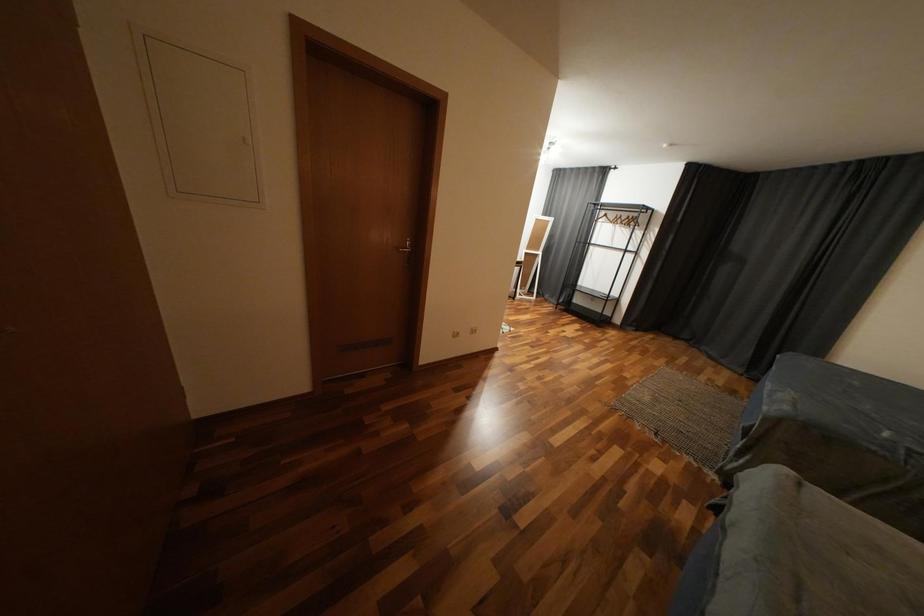
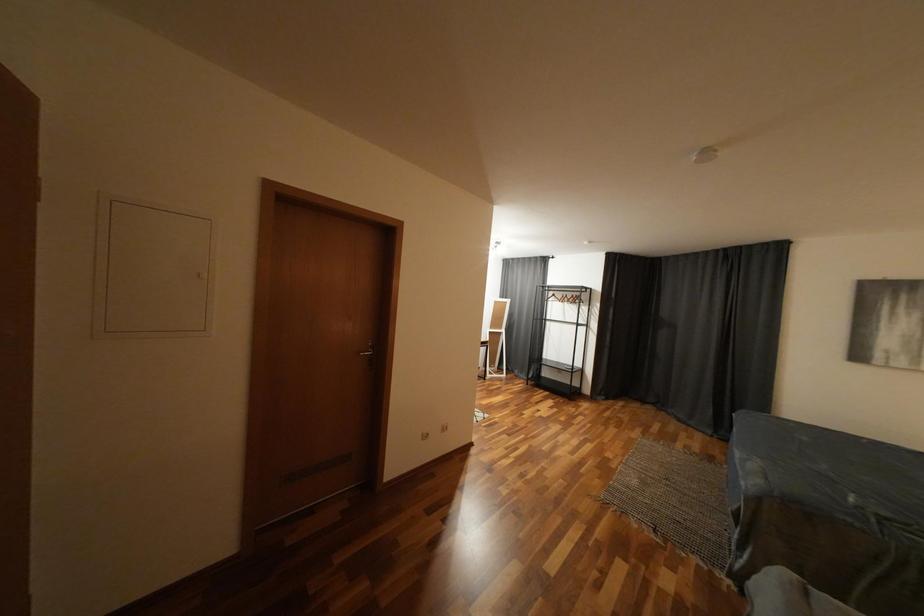
In a continuous first-person perspective shot, in which direction is the camera moving?

The cameraman walked toward right, backward.